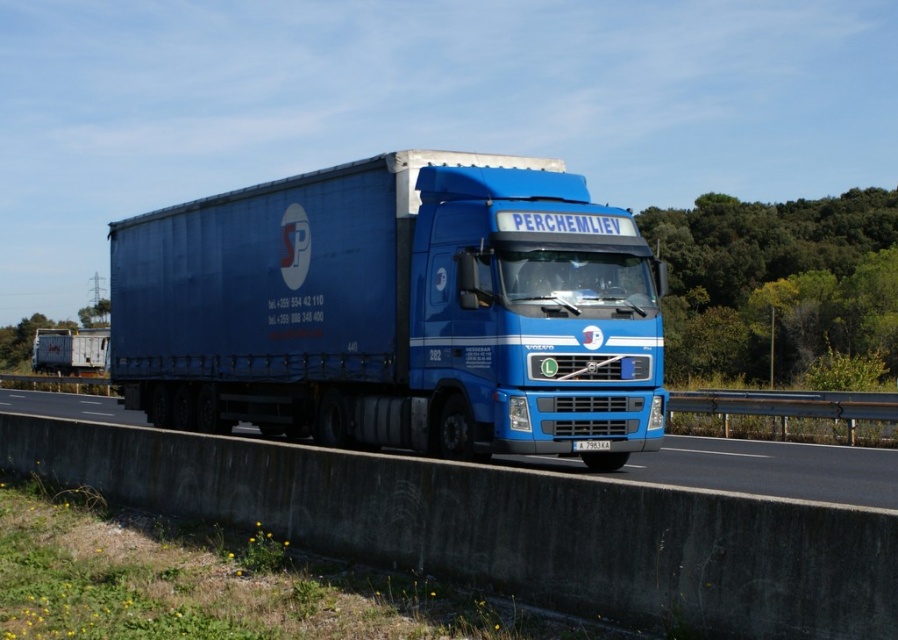
Question: Is blue matte trailer truck at center in front of blue metallic truck at center?

Choices:
 (A) yes
 (B) no

Answer: (B)

Question: Which of the following is the farthest from the observer?

Choices:
 (A) (851, 492)
 (B) (553, 269)

Answer: (B)

Question: Which of the following is the closest to the observer?

Choices:
 (A) blue metallic truck at center
 (B) blue matte trailer truck at center

Answer: (A)

Question: Does blue matte trailer truck at center have a lesser width compared to blue metallic truck at center?

Choices:
 (A) no
 (B) yes

Answer: (B)

Question: Does blue matte trailer truck at center have a lesser width compared to blue metallic truck at center?

Choices:
 (A) no
 (B) yes

Answer: (B)